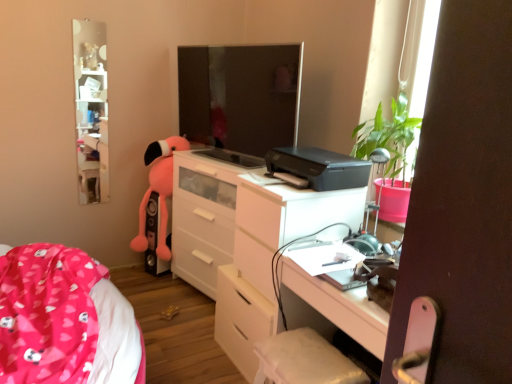
Describe the element at coordinates (319, 167) in the screenshot. I see `black plastic printer at center` at that location.

Where is `black plastic printer at center`? black plastic printer at center is located at coordinates (319, 167).

In order to face white glossy cabinet at upper left, should I rotate leftwards or rightwards?

You should look left and rotate roughly 20.952 degrees.

Where is `pink fabric bed at lower left`? pink fabric bed at lower left is located at coordinates (64, 320).

Image resolution: width=512 pixels, height=384 pixels. In order to click on matte black monitor at center in this screenshot , I will do `click(240, 96)`.

Find the location of a particular element. Image resolution: width=512 pixels, height=384 pixels. white glossy chest of drawers at center is located at coordinates tap(243, 239).

Measure the distance between white glossy chest of drawers at center and camera.

white glossy chest of drawers at center and camera are 5.89 feet apart.

Where is `black plastic printer at center`? black plastic printer at center is located at coordinates (319, 167).

Are white glossy chest of drawers at center and pink fabric bed at lower left making contact?

white glossy chest of drawers at center is not next to pink fabric bed at lower left, and they're not touching.

Would you say white glossy chest of drawers at center is inside or outside pink fabric bed at lower left?

The correct answer is: outside.

Between white glossy chest of drawers at center and pink fabric bed at lower left, which one has larger width?

pink fabric bed at lower left.

Consider the image. Between white glossy chest of drawers at center and pink fabric bed at lower left, which one has larger size?

white glossy chest of drawers at center.

Is white fabric swivel chair at lower center completely or partially outside of matte black monitor at center?

Indeed, white fabric swivel chair at lower center is completely outside matte black monitor at center.

Is point (280, 368) positioned after point (243, 60)?

No, it is not.

Is white fabric swivel chair at lower center shorter than matte black monitor at center?

Yes.

What's the angular difference between white fabric swivel chair at lower center and matte black monitor at center's facing directions?

They differ by 12.8 degrees in their facing directions.

Between black plastic printer at center and pink fabric bed at lower left, which one has larger size?

pink fabric bed at lower left.

From the image's perspective, is black plastic printer at center on pink fabric bed at lower left?

Yes, from the image's perspective, black plastic printer at center is on top of pink fabric bed at lower left.

What's the angular difference between black plastic printer at center and pink fabric bed at lower left's facing directions?

The angular difference between black plastic printer at center and pink fabric bed at lower left is 159 degrees.

Does black plastic printer at center turn towards pink fabric bed at lower left?

No, black plastic printer at center is not turned towards pink fabric bed at lower left.

From the picture: Is pink fabric bed at lower left at the right side of matte black monitor at center?

In fact, pink fabric bed at lower left is to the left of matte black monitor at center.

Is point (26, 290) farther from viewer compared to point (200, 124)?

That is False.

Is matte black monitor at center at the back of pink fabric bed at lower left?

No.

Considering the sizes of objects black matte speaker at lower left and matte black monitor at center in the image provided, who is thinner, black matte speaker at lower left or matte black monitor at center?

With smaller width is matte black monitor at center.

Does black matte speaker at lower left turn towards matte black monitor at center?

No, black matte speaker at lower left is not oriented towards matte black monitor at center.

From the image's perspective, does black matte speaker at lower left appear higher than matte black monitor at center?

No, from the image's perspective, black matte speaker at lower left is not over matte black monitor at center.

Who is shorter, black matte speaker at lower left or matte black monitor at center?

black matte speaker at lower left.

What's the angular difference between black plastic printer at center and white glossy chest of drawers at center's facing directions?

The angle between the facing direction of black plastic printer at center and the facing direction of white glossy chest of drawers at center is 11.6 degrees.

Considering their positions, is black plastic printer at center located in front of or behind white glossy chest of drawers at center?

black plastic printer at center is in front of white glossy chest of drawers at center.

Does point (310, 169) come in front of point (342, 205)?

That is True.

In order to click on printer above the white glossy chest of drawers at center (from the image's perspective) in this screenshot , I will do `click(319, 167)`.

This screenshot has height=384, width=512. In order to click on toy that is behind the black plastic printer at center in this screenshot , I will do `click(159, 191)`.

Looking at their sizes, would you say pink plush toy at left is wider or thinner than black plastic printer at center?

pink plush toy at left is thinner than black plastic printer at center.

Can you confirm if pink plush toy at left is bigger than black plastic printer at center?

Yes.

Is pink plush toy at left facing away from black plastic printer at center?

No, black plastic printer at center is not at the back of pink plush toy at left.

The height and width of the screenshot is (384, 512). What are the coordinates of `bed above the white glossy chest of drawers at center (from a real-world perspective)` in the screenshot? It's located at (64, 320).

Find the location of a particular element. This screenshot has width=512, height=384. swivel chair that appears below the matte black monitor at center (from the image's perspective) is located at coordinates (304, 360).

Looking at this image, based on their spatial positions, is pink fabric bed at lower left or white glossy chest of drawers at center closer to white fabric swivel chair at lower center?

The object closer to white fabric swivel chair at lower center is white glossy chest of drawers at center.

From the image, which object appears to be farther from pink fabric bed at lower left, white glossy chest of drawers at center or black plastic printer at center?

black plastic printer at center is positioned further to the anchor pink fabric bed at lower left.

When comparing their distances from pink plush toy at left, does black matte speaker at lower left or white fabric swivel chair at lower center seem further?

Among the two, white fabric swivel chair at lower center is located further to pink plush toy at left.

From the image, which object appears to be nearer to matte black monitor at center, pink plush toy at left or white fabric swivel chair at lower center?

Among the two, pink plush toy at left is located nearer to matte black monitor at center.

From the image, which object appears to be farther from white glossy chest of drawers at center, white fabric swivel chair at lower center or black plastic printer at center?

Based on the image, white fabric swivel chair at lower center appears to be further to white glossy chest of drawers at center.

Looking at the image, which one is located closer to matte black monitor at center, white glossy cabinet at upper left or white glossy chest of drawers at center?

Based on the image, white glossy chest of drawers at center appears to be nearer to matte black monitor at center.

Looking at the image, which one is located further to matte black monitor at center, black plastic printer at center or white glossy cabinet at upper left?

Among the two, white glossy cabinet at upper left is located further to matte black monitor at center.

Which object lies further to the anchor point white fabric swivel chair at lower center, white glossy cabinet at upper left or white glossy chest of drawers at center?

white glossy cabinet at upper left is positioned further to the anchor white fabric swivel chair at lower center.

You are a GUI agent. You are given a task and a screenshot of the screen. Output one action in this format:
    pyautogui.click(x=<x>, y=<y>)
    Task: Click on the chest of drawers between black plastic printer at center and pink plush toy at left from front to back
    The image size is (512, 384).
    Given the screenshot: What is the action you would take?
    pyautogui.click(x=243, y=239)

Find the location of a particular element. The height and width of the screenshot is (384, 512). speaker located between white glossy cabinet at upper left and white glossy chest of drawers at center in the left-right direction is located at coordinates (154, 237).

Locate an element on the screen. This screenshot has height=384, width=512. toy between pink fabric bed at lower left and black matte speaker at lower left along the z-axis is located at coordinates (159, 191).

Image resolution: width=512 pixels, height=384 pixels. I want to click on toy located between white glossy cabinet at upper left and white glossy chest of drawers at center in the left-right direction, so click(159, 191).